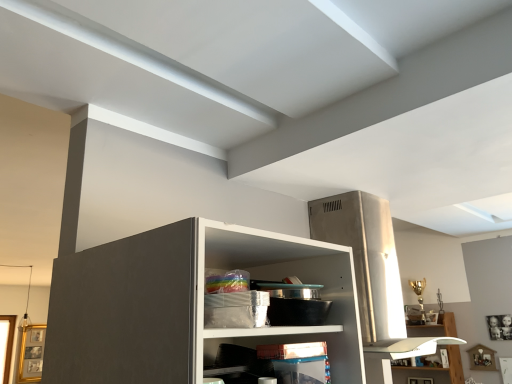
Question: In the image, is white glossy shelf at lower right, placed as the 2th shelf when sorted from top to bottom, positioned in front of or behind translucent plastic container at lower center, which is counted as the 1th shelf, starting from the left?

Choices:
 (A) behind
 (B) front

Answer: (A)

Question: Visually, is white glossy shelf at lower right, the 1th shelf ordered from the bottom, positioned to the left or to the right of translucent plastic container at lower center, the first shelf in the front-to-back sequence?

Choices:
 (A) right
 (B) left

Answer: (A)

Question: From the image's perspective, relative to translucent plastic container at lower center, which appears as the 2th shelf when ordered from the bottom, is white glossy shelf at lower right, the 1th shelf ordered from the bottom, above or below?

Choices:
 (A) above
 (B) below

Answer: (B)

Question: Looking at the image, does translucent plastic container at lower center, the second shelf in the back-to-front sequence, seem bigger or smaller compared to white glossy shelf at lower right, the 1th shelf ordered from the bottom?

Choices:
 (A) small
 (B) big

Answer: (A)

Question: From the image's perspective, is translucent plastic container at lower center, which appears as the 2th shelf when ordered from the bottom, above or below white glossy shelf at lower right, placed as the 2th shelf when sorted from top to bottom?

Choices:
 (A) below
 (B) above

Answer: (B)

Question: Which is correct: translucent plastic container at lower center, which appears as the 2th shelf when ordered from the bottom, is inside white glossy shelf at lower right, positioned as the 1th shelf in back-to-front order, or outside of it?

Choices:
 (A) outside
 (B) inside

Answer: (A)

Question: Does point (315, 332) appear closer or farther from the camera than point (458, 372)?

Choices:
 (A) farther
 (B) closer

Answer: (B)